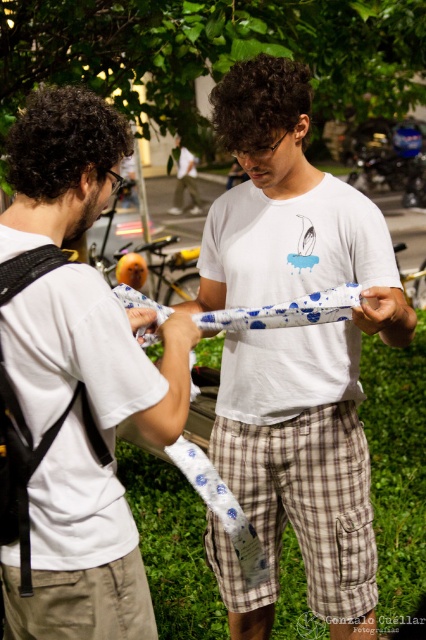
Is point (218, 432) positioned after point (92, 376)?

That is True.

Who is shorter, white cotton t-shirt at center or white matte t-shirt at center?

Standing shorter between the two is white matte t-shirt at center.

What are the coordinates of `white cotton t-shirt at center` in the screenshot? It's located at (293, 353).